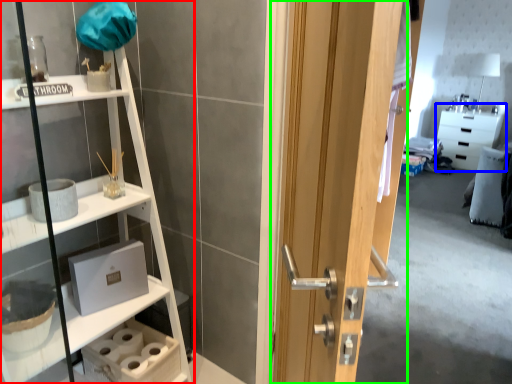
Question: Based on their relative distances, which object is farther from shelf (highlighted by a red box)? Choose from cabinetry (highlighted by a blue box) and door (highlighted by a green box).

Choices:
 (A) cabinetry
 (B) door

Answer: (A)